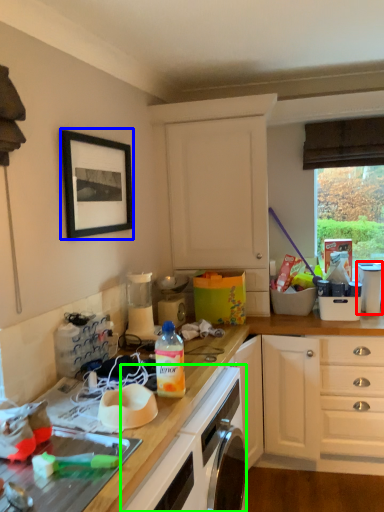
Question: Based on their relative distances, which object is farther from appliance (highlighted by a red box)? Choose from picture frame (highlighted by a blue box) and oven (highlighted by a green box).

Choices:
 (A) picture frame
 (B) oven

Answer: (A)